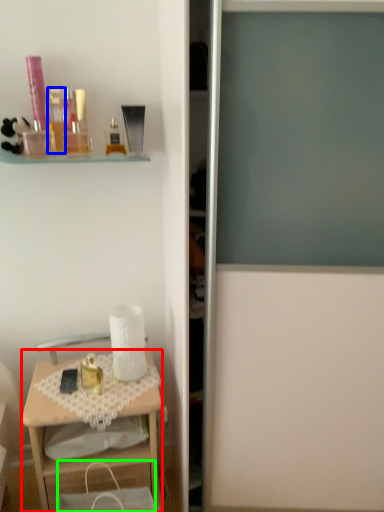
Question: Estimate the real-world distances between objects in this image. Which object is farther from desk (highlighted by a red box), toiletry (highlighted by a blue box) or handbag (highlighted by a green box)?

Choices:
 (A) toiletry
 (B) handbag

Answer: (A)